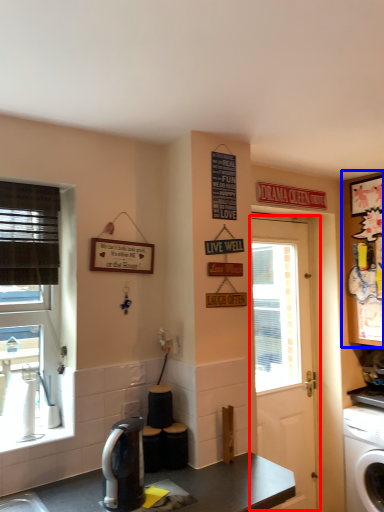
Question: Which of the following is the closest to the observer, door (highlighted by a red box) or cabinetry (highlighted by a blue box)?

Choices:
 (A) door
 (B) cabinetry

Answer: (A)